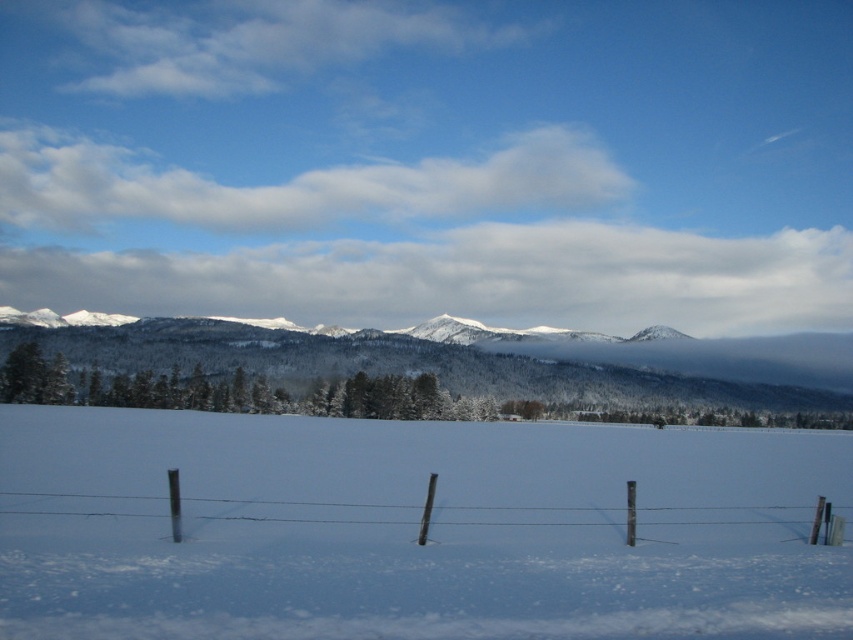
Question: Is white powdery snow at center thinner than wooden post wire fence at lower center?

Choices:
 (A) yes
 (B) no

Answer: (B)

Question: Which point appears farthest from the camera in this image?

Choices:
 (A) (334, 522)
 (B) (564, 609)

Answer: (A)

Question: Is white powdery snow at center bigger than snow-covered mountain at center?

Choices:
 (A) yes
 (B) no

Answer: (B)

Question: Which point is farther to the camera?

Choices:
 (A) wooden post wire fence at lower center
 (B) snow-covered mountain at center

Answer: (B)

Question: Considering the real-world distances, which object is farthest from the wooden post wire fence at lower center?

Choices:
 (A) snow-covered mountain at center
 (B) white powdery snow at center

Answer: (A)

Question: Does snow-covered mountain at center have a lesser width compared to wooden post wire fence at lower center?

Choices:
 (A) no
 (B) yes

Answer: (A)